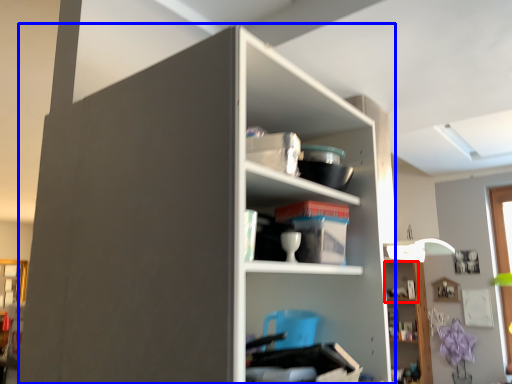
Question: Which object appears farthest to the camera in this image, cabinet (highlighted by a red box) or shelf (highlighted by a blue box)?

Choices:
 (A) cabinet
 (B) shelf

Answer: (A)